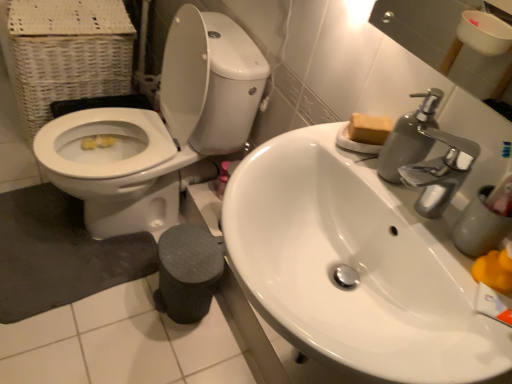
This screenshot has width=512, height=384. In order to click on free spot below dark gray textured bath mat at lower left (from a real-world perspective) in this screenshot , I will do `click(47, 248)`.